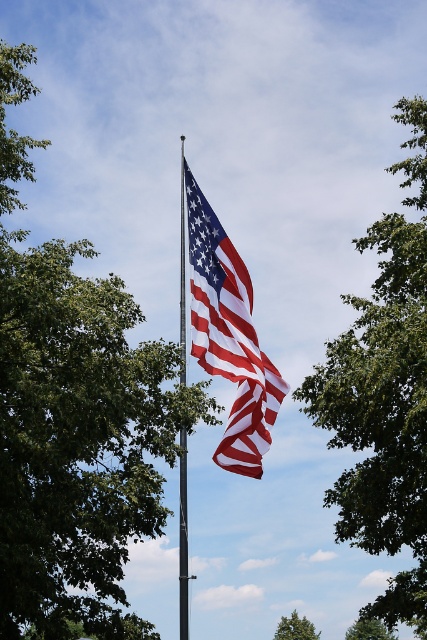
You are an observer looking at the scene. You see the green leafy tree at upper left and the green leafy tree at upper center. Which tree is positioned higher in the image?

The green leafy tree at upper left is located above the green leafy tree at upper center in the image.

From the picture: You are a park maintenance worker needing to replace the flagpole. You have a ladder that is 30 feet tall. The flagpole is between the green leafy tree at upper center and the green leafy tree at center. Can you estimate if your ladder is tall enough to reach the top of the flagpole?

The distance between the green leafy tree at upper center and green leafy tree at center is 32.67 feet. Since the ladder is only 30 feet tall, it is shorter than the distance between the two trees. Therefore, the ladder is not tall enough to reach the top of the flagpole.

You are standing in front of the American flag shown in the image. There are two points marked on the flagpole. The first point is at coordinates point (208, 401) and the second point is at point (376, 628). If you were to look at these points from your current position, which point would appear closer to you?

Point (208, 401) is closer to the camera than point (376, 628), so the first point would appear closer to you.